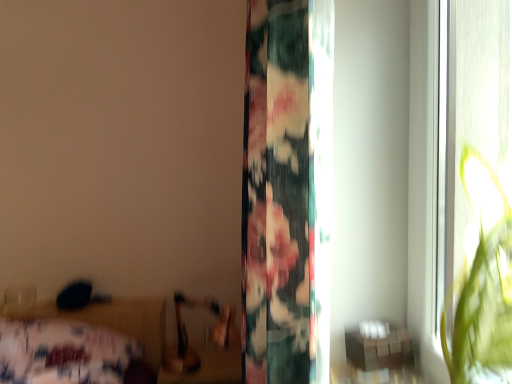
Question: Can we say floral fabric curtain at center lies outside floral fabric bed at lower left?

Choices:
 (A) no
 (B) yes

Answer: (B)

Question: From the image's perspective, is floral fabric curtain at center below floral fabric bed at lower left?

Choices:
 (A) no
 (B) yes

Answer: (A)

Question: From a real-world perspective, is floral fabric curtain at center positioned over floral fabric bed at lower left based on gravity?

Choices:
 (A) yes
 (B) no

Answer: (A)

Question: Considering the relative positions of floral fabric curtain at center and floral fabric bed at lower left in the image provided, is floral fabric curtain at center to the right of floral fabric bed at lower left from the viewer's perspective?

Choices:
 (A) yes
 (B) no

Answer: (A)

Question: Can you see floral fabric curtain at center touching floral fabric bed at lower left?

Choices:
 (A) no
 (B) yes

Answer: (A)

Question: Could you tell me if floral fabric curtain at center is turned towards floral fabric bed at lower left?

Choices:
 (A) yes
 (B) no

Answer: (B)

Question: Is wooden table at lower right at the right side of floral fabric bed at lower left?

Choices:
 (A) no
 (B) yes

Answer: (B)

Question: Is wooden table at lower right beside floral fabric bed at lower left?

Choices:
 (A) yes
 (B) no

Answer: (B)

Question: Is the position of wooden table at lower right less distant than that of floral fabric bed at lower left?

Choices:
 (A) yes
 (B) no

Answer: (A)

Question: Considering the relative sizes of wooden table at lower right and floral fabric bed at lower left in the image provided, is wooden table at lower right taller than floral fabric bed at lower left?

Choices:
 (A) yes
 (B) no

Answer: (B)

Question: From the image's perspective, is wooden table at lower right under floral fabric bed at lower left?

Choices:
 (A) yes
 (B) no

Answer: (B)

Question: Is wooden table at lower right further to the viewer compared to floral fabric bed at lower left?

Choices:
 (A) yes
 (B) no

Answer: (B)

Question: From the image's perspective, does floral fabric curtain at center appear lower than wooden table at lower right?

Choices:
 (A) yes
 (B) no

Answer: (B)